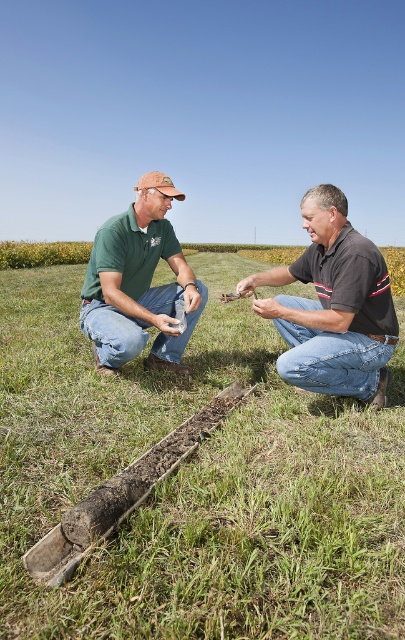
You are a photographer trying to capture a group photo of the two people in the scene. Since you want to make sure everyone looks balanced in the photo, you need to know which person is thinner. Which person is thinner between the black matte shirt at center and the green matte shirt at center?

The black matte shirt at center is thinner than the green matte shirt at center, so the photographer should position them accordingly to achieve a balanced composition.

You are standing in the field and want to place a small flag exactly where the green grass at center and the green matte shirt at center are aligned vertically. Where should you place the flag?

The green grass at center is located below the green matte shirt at center, so you should place the flag at the position where the green grass at center is, since it is lower down.